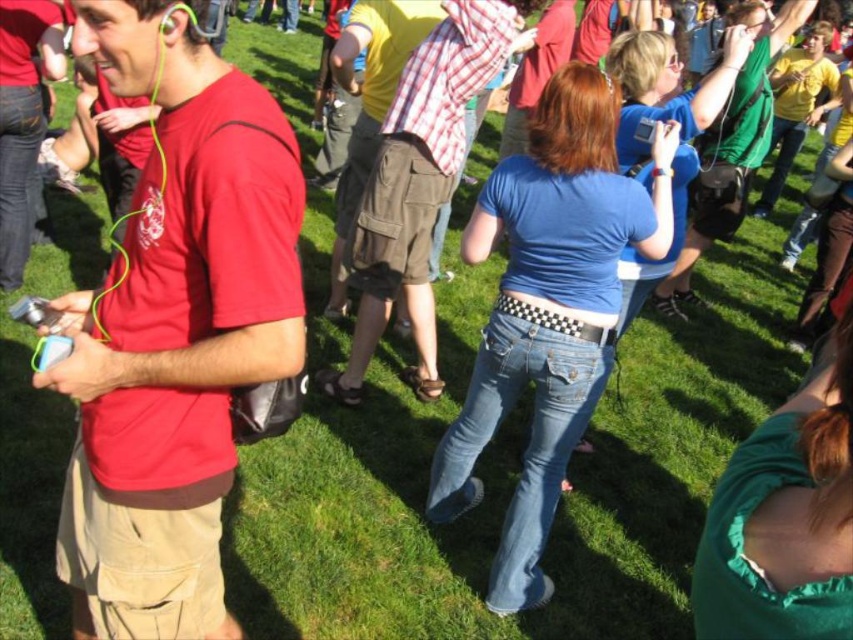
Question: Which point is farther to the camera?

Choices:
 (A) (280, 182)
 (B) (762, 81)

Answer: (B)

Question: Can you confirm if matte red t-shirt at left is positioned to the left of green matte shirt at upper right?

Choices:
 (A) yes
 (B) no

Answer: (A)

Question: Does matte red t-shirt at left appear over green matte shirt at upper right?

Choices:
 (A) yes
 (B) no

Answer: (B)

Question: Does matte red t-shirt at left appear on the left side of green matte shirt at upper right?

Choices:
 (A) yes
 (B) no

Answer: (A)

Question: Which object appears closest to the camera in this image?

Choices:
 (A) green matte shirt at upper right
 (B) matte red t-shirt at left

Answer: (B)